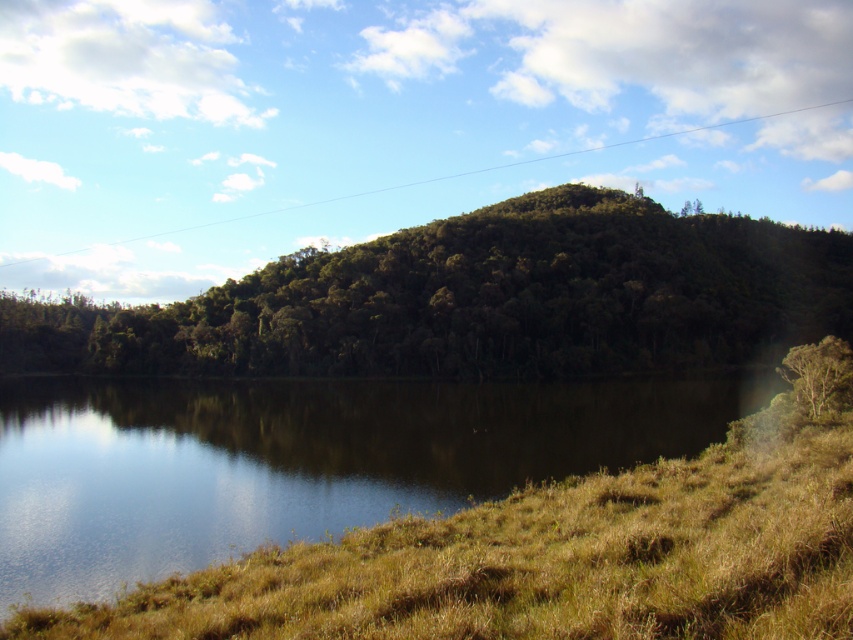
Looking at this image, you are standing at the edge of the water in the image. You see a point marked at coordinates (299, 460). What does this point represent?

The point at coordinates (299, 460) marks green grassy water at lower left.

You are a hiker trying to determine which tree is wider between the green leafy tree at center and the green leafy tree at right. Which one has a larger width?

The green leafy tree at center has a larger width than the green leafy tree at right.